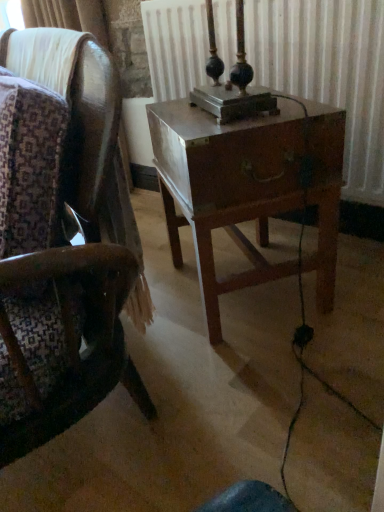
Question: Choose the correct answer: Is metallic radiator at center inside wooden chair at center or outside it?

Choices:
 (A) inside
 (B) outside

Answer: (B)

Question: Is metallic radiator at center in front of or behind wooden chair at center in the image?

Choices:
 (A) behind
 (B) front

Answer: (A)

Question: Which is nearer to the wooden nightstand at center?

Choices:
 (A) wooden chair at center
 (B) metallic radiator at center

Answer: (A)

Question: Based on their relative distances, which object is nearer to the wooden chair at center?

Choices:
 (A) metallic radiator at center
 (B) wooden nightstand at center

Answer: (B)